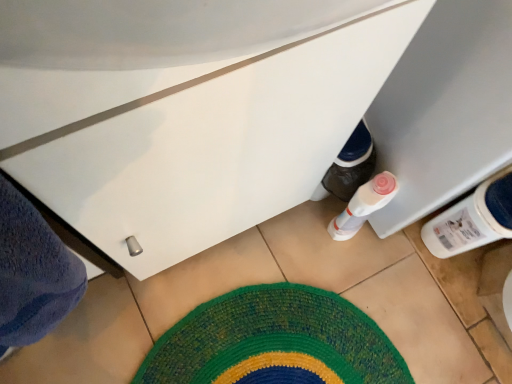
Question: Considering the positions of multicolored woven mat at center and white glossy cabinet at lower center in the image, is multicolored woven mat at center wider or thinner than white glossy cabinet at lower center?

Choices:
 (A) wide
 (B) thin

Answer: (A)

Question: Is point (359, 339) closer or farther from the camera than point (246, 89)?

Choices:
 (A) farther
 (B) closer

Answer: (A)

Question: Estimate the real-world distances between objects in this image. Which object is farther from the white plastic bottle at lower right?

Choices:
 (A) white glossy cabinet at lower center
 (B) multicolored woven mat at center

Answer: (A)

Question: Which is farther from the white glossy cabinet at lower center?

Choices:
 (A) white plastic bottle at lower right
 (B) multicolored woven mat at center

Answer: (B)